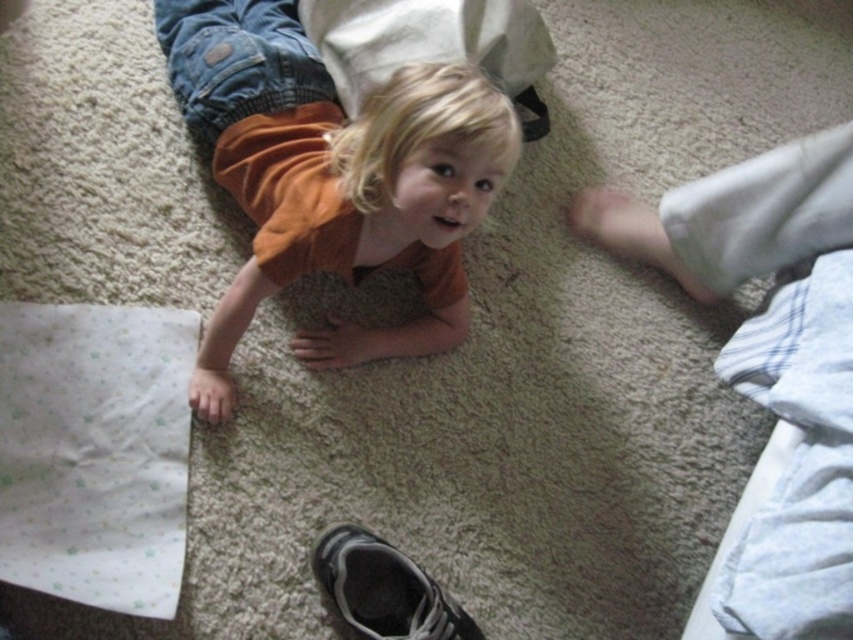
Question: Is orange cotton shirt at center wider than black suede shoe at lower center?

Choices:
 (A) yes
 (B) no

Answer: (A)

Question: Estimate the real-world distances between objects in this image. Which object is farther from the black suede shoe at lower center?

Choices:
 (A) matte orange shirt at center
 (B) orange cotton shirt at center

Answer: (A)

Question: Which object appears farthest from the camera in this image?

Choices:
 (A) black suede shoe at lower center
 (B) matte orange shirt at center

Answer: (A)

Question: Can you confirm if orange cotton shirt at center is positioned above black suede shoe at lower center?

Choices:
 (A) no
 (B) yes

Answer: (B)

Question: In this image, where is orange cotton shirt at center located relative to matte orange shirt at center?

Choices:
 (A) above
 (B) below

Answer: (A)

Question: Which point is farther to the camera?

Choices:
 (A) orange cotton shirt at center
 (B) matte orange shirt at center
 (C) black suede shoe at lower center

Answer: (C)